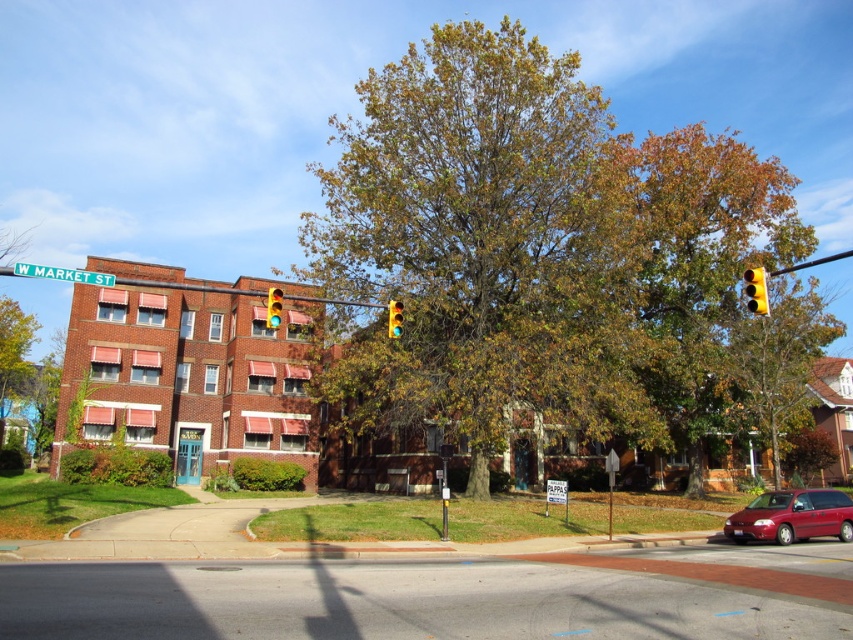
You are a delivery person approaching the building and need to park your vehicle. The shiny red minivan at center is blocking the entrance. Can you maneuver around it by going past the brown textured tree at right?

The brown textured tree at right is to the right of the shiny red minivan at center, so you can maneuver around the minivan by driving past the tree on the right side.

You are a drone operator trying to capture a photo of the brown textured tree at right from above. The drone must stay within the rectangular area defined by coordinates from point A at bottom left corner at 0.0, 0.0 to point B at top right corner at 1.0, 1.0. Can the drone capture the tree within this area?

The brown textured tree at right is located at point (780, 358), which falls within the rectangular area from (0, 0) to (852, 639). Therefore, the drone can capture the tree within this area.